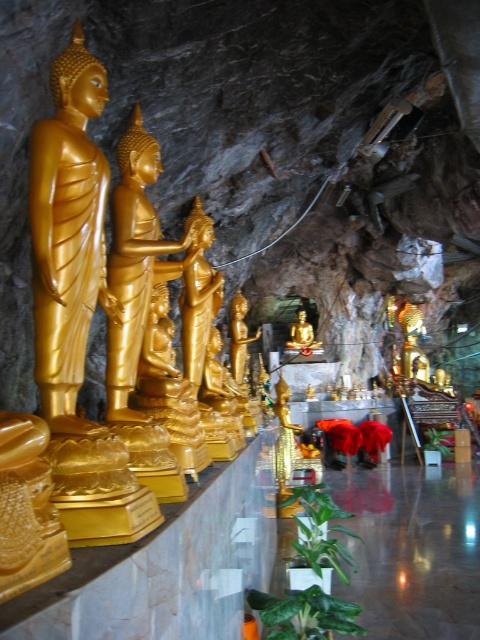
Question: Which of the following is the farthest from the observer?

Choices:
 (A) gold polished statue at center
 (B) gold polished statue at left

Answer: (A)

Question: Which point is closer to the camera taking this photo?

Choices:
 (A) (244, 372)
 (B) (92, 252)

Answer: (B)

Question: Can you confirm if gold polished statue at left is thinner than gold polished statue at center?

Choices:
 (A) yes
 (B) no

Answer: (A)

Question: Is gold polished statue at left bigger than gold polished statue at center?

Choices:
 (A) no
 (B) yes

Answer: (A)

Question: Is gold polished statue at left wider than gold polished statue at center?

Choices:
 (A) no
 (B) yes

Answer: (A)